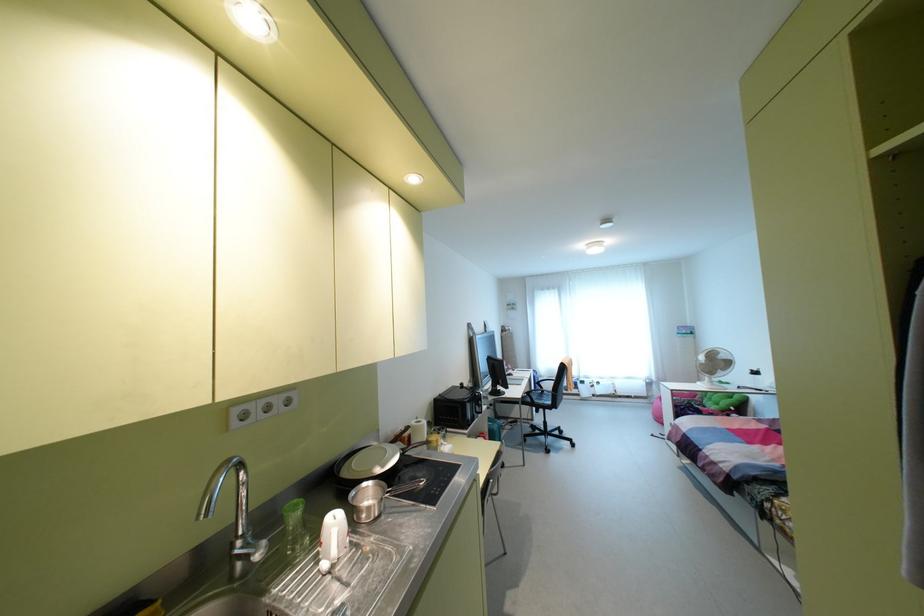
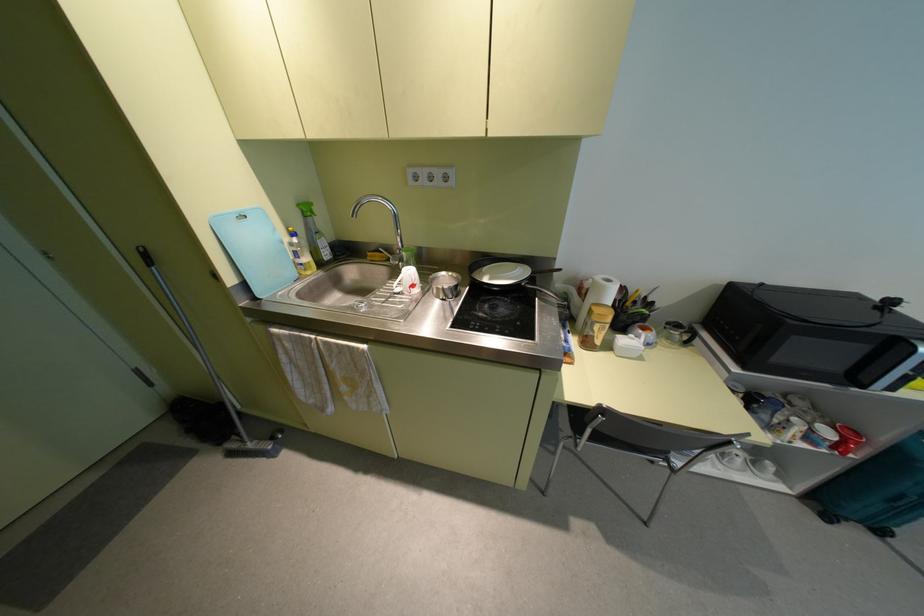
Find the pixel in the second image that matches point (502, 464) in the first image.

(880, 531)